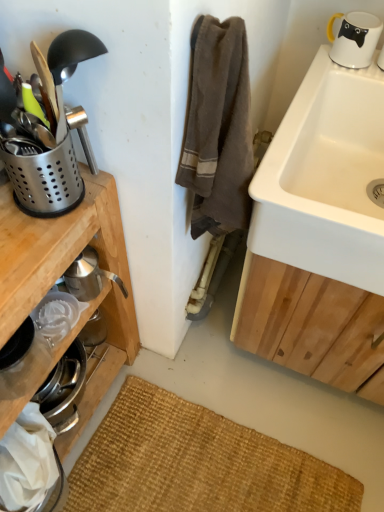
Question: From a real-world perspective, is white ceramic sink at upper right over polished stainless steel utensil holder at left, positioned as the 1th appliance in front-to-back order?

Choices:
 (A) no
 (B) yes

Answer: (A)

Question: From the image's perspective, is white ceramic sink at upper right located beneath polished stainless steel utensil holder at left, positioned as the 1th appliance in front-to-back order?

Choices:
 (A) no
 (B) yes

Answer: (A)

Question: Is polished stainless steel utensil holder at left, which is the 2th appliance from back to front, at the back of white ceramic sink at upper right?

Choices:
 (A) yes
 (B) no

Answer: (B)

Question: Considering the relative sizes of white ceramic sink at upper right and polished stainless steel utensil holder at left, positioned as the 1th appliance in front-to-back order, in the image provided, is white ceramic sink at upper right thinner than polished stainless steel utensil holder at left, positioned as the 1th appliance in front-to-back order,?

Choices:
 (A) yes
 (B) no

Answer: (B)

Question: Are white ceramic sink at upper right and polished stainless steel utensil holder at left, which is the 2th appliance from back to front, located far from each other?

Choices:
 (A) no
 (B) yes

Answer: (A)

Question: Considering the relative sizes of white ceramic sink at upper right and polished stainless steel utensil holder at left, which is the 2th appliance from back to front, in the image provided, is white ceramic sink at upper right wider than polished stainless steel utensil holder at left, which is the 2th appliance from back to front,?

Choices:
 (A) yes
 (B) no

Answer: (A)

Question: Are polished stainless steel utensil holder at left, which is the 2th appliance from back to front, and white ceramic sink at upper right far apart?

Choices:
 (A) no
 (B) yes

Answer: (A)

Question: Is the surface of polished stainless steel utensil holder at left, positioned as the 1th appliance in front-to-back order, in direct contact with white ceramic sink at upper right?

Choices:
 (A) yes
 (B) no

Answer: (B)

Question: Can you confirm if polished stainless steel utensil holder at left, which is the 2th appliance from back to front, is bigger than white ceramic sink at upper right?

Choices:
 (A) no
 (B) yes

Answer: (A)

Question: Can you confirm if polished stainless steel utensil holder at left, which is the 2th appliance from back to front, is wider than white ceramic sink at upper right?

Choices:
 (A) yes
 (B) no

Answer: (B)

Question: From the image's perspective, is polished stainless steel utensil holder at left, which is the 2th appliance from back to front, located above white ceramic sink at upper right?

Choices:
 (A) no
 (B) yes

Answer: (A)

Question: Is polished stainless steel utensil holder at left, which is the 2th appliance from back to front, at the left side of white ceramic sink at upper right?

Choices:
 (A) yes
 (B) no

Answer: (A)

Question: Is polished stainless steel utensil holder at left, positioned as the 1th appliance in front-to-back order, looking in the opposite direction of white glossy mug at upper right?

Choices:
 (A) no
 (B) yes

Answer: (A)